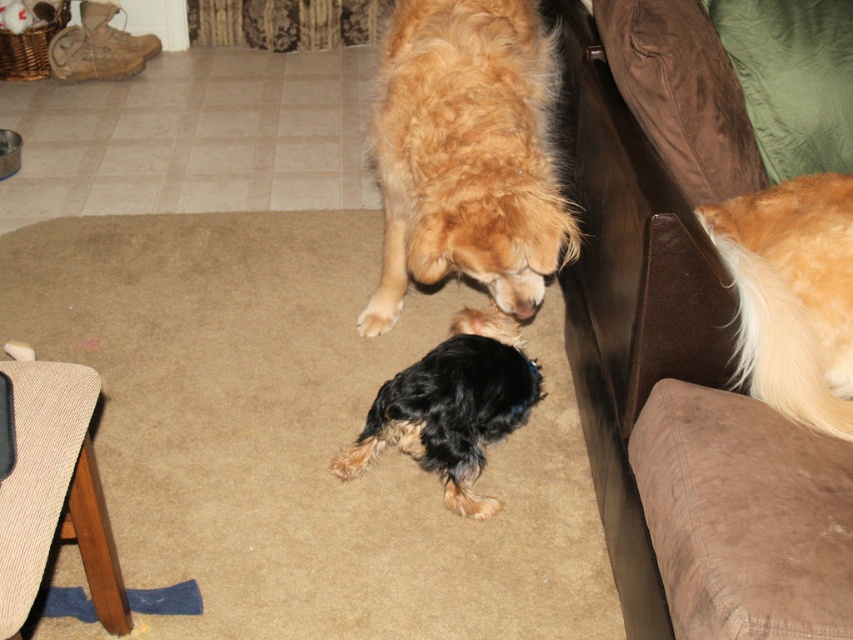
You are a dog owner trying to decide if your golden fur dog at center can comfortably lie on the brown suede couch at upper right. Based on their sizes, can it fit?

The brown suede couch at upper right is larger in size than the golden fur dog at center, so the dog should be able to lie comfortably on it.

You are a photographer positioned at the back of the room. You want to take a photo of the golden fur dog at center without the brown suede couch at upper right appearing in the background. Is this possible given their positions?

The brown suede couch at upper right is closer to the viewer than the golden fur dog at center. Since the couch is closer, it would block the view of the dog if they are aligned along the same line of sight. Therefore, you cannot take a photo of the golden fur dog at center without the brown suede couch at upper right appearing in the background unless you adjust your angle or position.

You are a dog trainer observing the scene. You need to ensure the golden fur dog at right has enough space to move freely without bumping into the brown suede couch at upper right. What is the minimum distance you should maintain between them?

The minimum distance you should maintain between the golden fur dog at right and the brown suede couch at upper right is 22.27 centimeters, as that is the current distance between them in the scene.